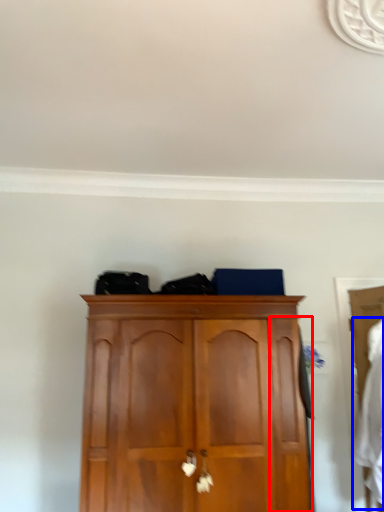
Question: Among these objects, which one is farthest to the camera, door (highlighted by a red box) or clothing (highlighted by a blue box)?

Choices:
 (A) door
 (B) clothing

Answer: (A)